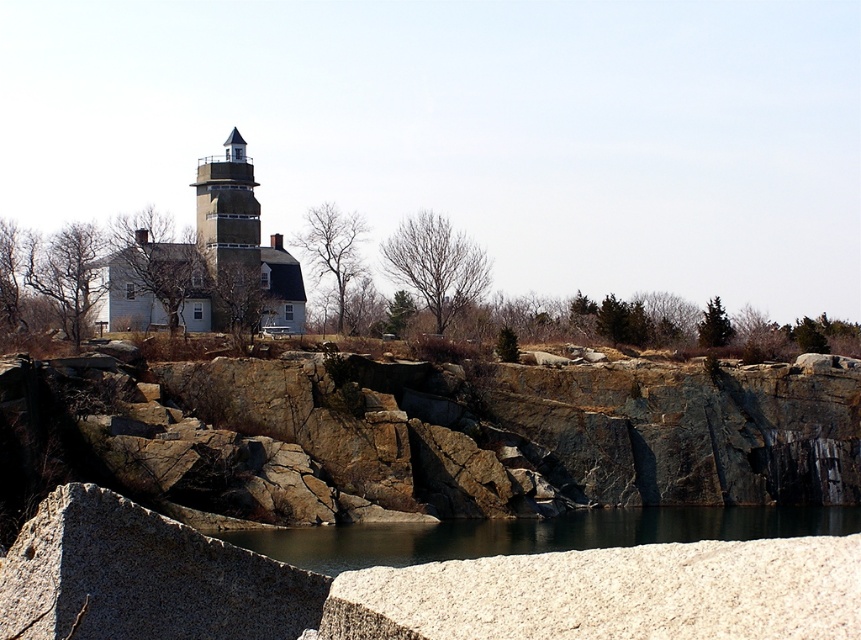
Question: Which object appears farthest from the camera in this image?

Choices:
 (A) brown rock cliff at center
 (B) matte gray stone tower at center
 (C) dark gray water at center

Answer: (B)

Question: Is brown rock cliff at center smaller than dark gray water at center?

Choices:
 (A) no
 (B) yes

Answer: (A)

Question: Which of the following is the farthest from the observer?

Choices:
 (A) matte gray stone tower at center
 (B) brown rock cliff at center
 (C) dark gray water at center

Answer: (A)

Question: Which point is farther to the camera?

Choices:
 (A) brown rock cliff at center
 (B) dark gray water at center

Answer: (A)

Question: From the image, what is the correct spatial relationship of brown rock cliff at center in relation to matte gray stone tower at center?

Choices:
 (A) above
 (B) below

Answer: (B)

Question: Is brown rock cliff at center above dark gray water at center?

Choices:
 (A) yes
 (B) no

Answer: (A)